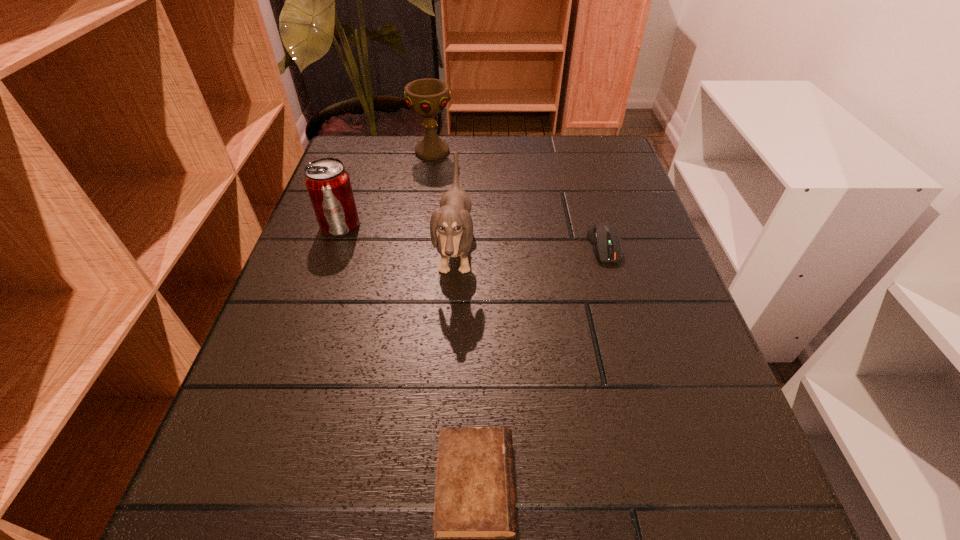
Locate an element on the screen. the farthest object is located at coordinates (427, 97).

Where is `puppy`? puppy is located at coordinates tap(453, 221).

Locate an element on the screen. the leftmost object is located at coordinates (328, 183).

This screenshot has width=960, height=540. Find the location of `pop soda`. pop soda is located at coordinates (328, 183).

You are a GUI agent. You are given a task and a screenshot of the screen. Output one action in this format:
    pyautogui.click(x=<x>, y=<y>)
    Task: Click on the rightmost object
    
    Given the screenshot: What is the action you would take?
    click(604, 238)

Find the location of a particular element. diary is located at coordinates (474, 498).

What are the coordinates of `free location located on the right of the chalice` in the screenshot? It's located at click(x=512, y=152).

I want to click on free space located at the face of the puppy, so click(565, 252).

You are a GUI agent. You are given a task and a screenshot of the screen. Output one action in this format:
    pyautogui.click(x=<x>, y=<y>)
    Task: Click on the vacant space located 0.280m on the front of the leftmost object
    
    Given the screenshot: What is the action you would take?
    297,353

Locate an element on the screen. vacant space located 0.090m on the button of the rightmost object is located at coordinates (620, 301).